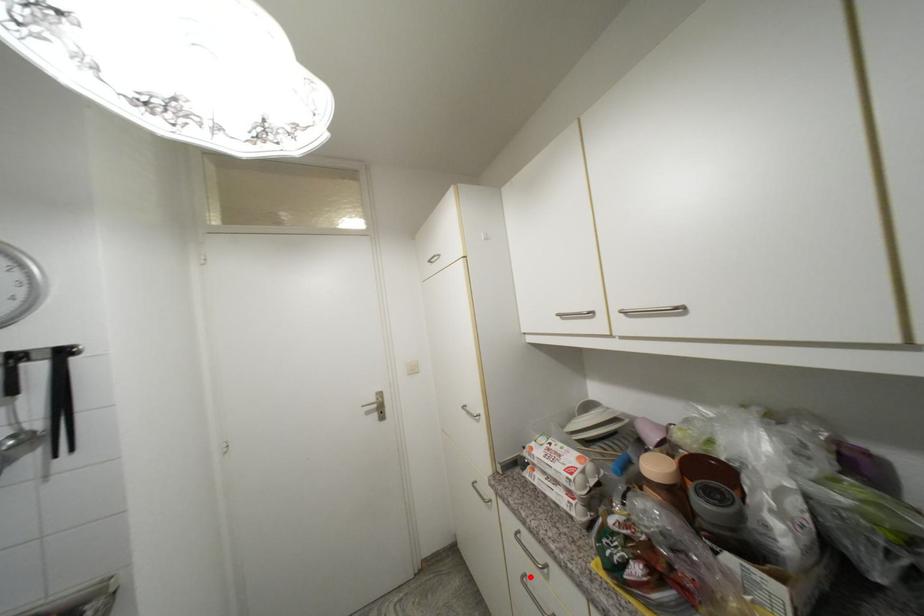
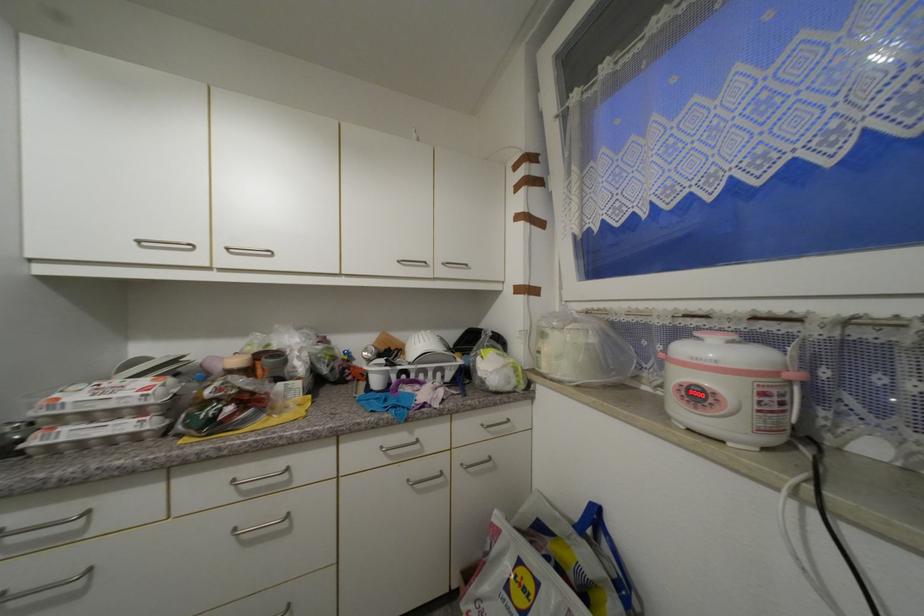
In the second image, find the point that corresponds to the highlighted location in the first image.

(6, 597)